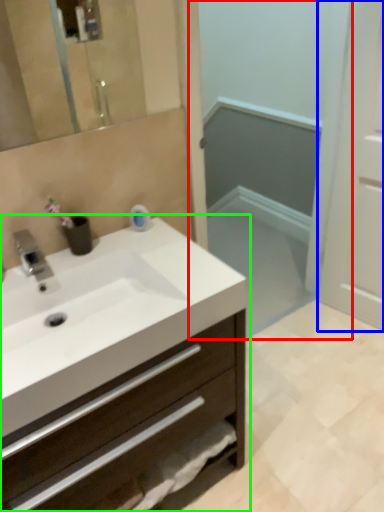
Question: Which object is positioned closest to screen door (highlighted by a red box)? Select from screen door (highlighted by a blue box) and bathroom cabinet (highlighted by a green box).

Choices:
 (A) screen door
 (B) bathroom cabinet

Answer: (A)